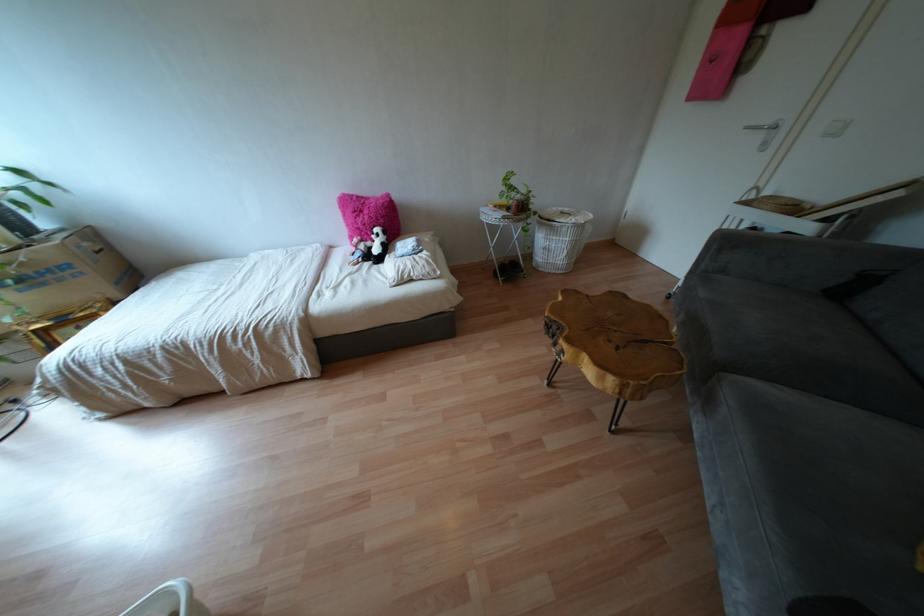
Where is `small plant pot`? The width and height of the screenshot is (924, 616). small plant pot is located at coordinates (517, 199).